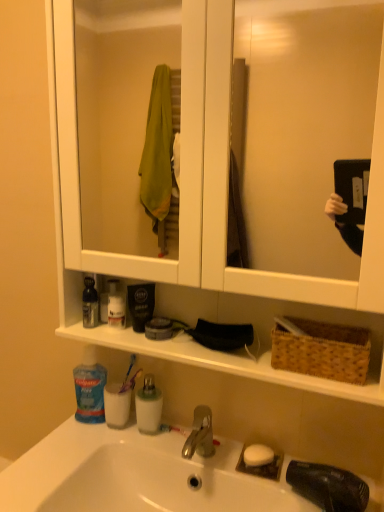
Identify the location of vacant area that is in front of clear plastic container at center. This screenshot has width=384, height=512. (147, 452).